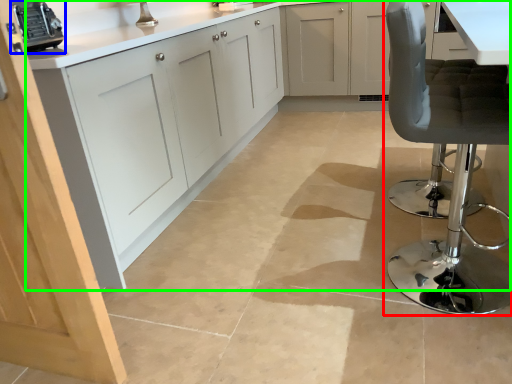
Question: Which object is positioned closest to chair (highlighted by a red box)? Select from appliance (highlighted by a blue box) and cabinetry (highlighted by a green box).

Choices:
 (A) appliance
 (B) cabinetry

Answer: (B)